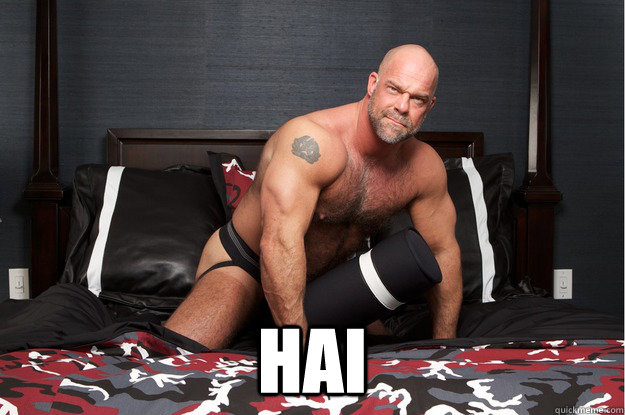
At what (x,y) coordinates should I click in order to perform the action: click on navy blue wall. Please return your answer as a coordinate pair (x, y). Looking at the image, I should click on (290, 55).